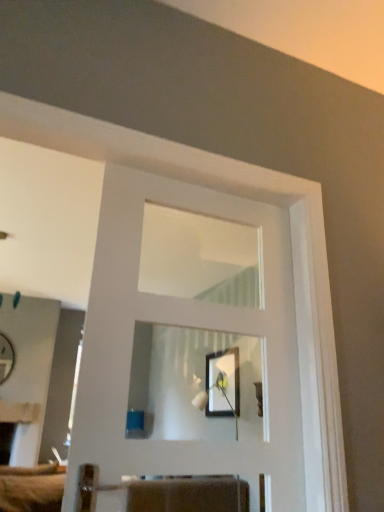
Question: From the image's perspective, relative to white glossy door at center, is matte black picture frame at center above or below?

Choices:
 (A) below
 (B) above

Answer: (A)

Question: Considering the positions of matte black picture frame at center and white glossy door at center in the image, is matte black picture frame at center taller or shorter than white glossy door at center?

Choices:
 (A) short
 (B) tall

Answer: (A)

Question: Which object is the farthest from the white glossy door at center?

Choices:
 (A) matte white mirror at left
 (B) matte black picture frame at center

Answer: (A)

Question: Considering the real-world distances, which object is farthest from the matte black picture frame at center?

Choices:
 (A) matte white mirror at left
 (B) white glossy door at center

Answer: (A)